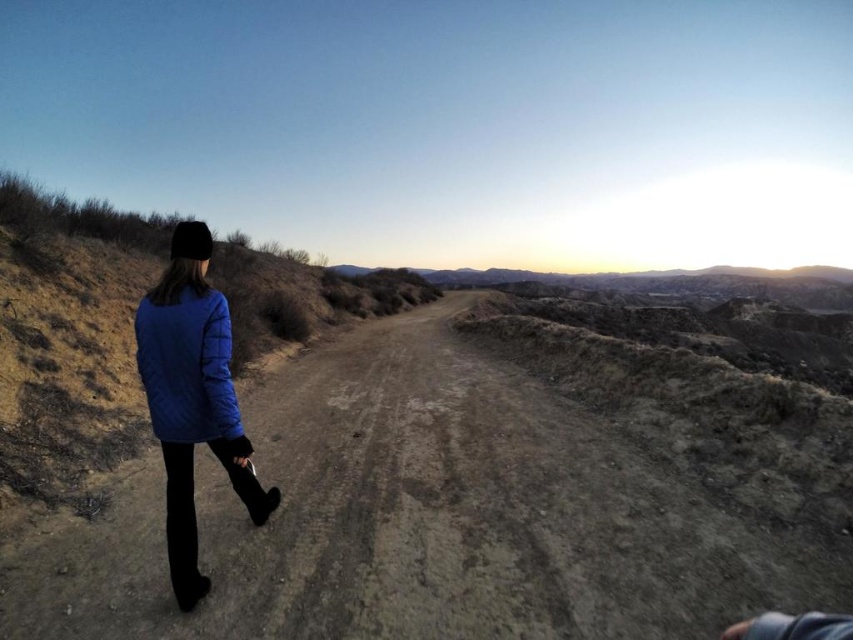
You are a hiker preparing to walk along the dirt path in the image. You see two jackets, the blue quilted jacket at lower left and the matte blue jacket at lower left. Which jacket is bigger in size?

The blue quilted jacket at lower left has a larger size compared to matte blue jacket at lower left.

You are standing at the starting point of the dirt path and see the blue quilted jacket at lower left and the matte blue jacket at lower left. Which jacket is closer to you?

Both jackets are at the lower left, but the blue quilted jacket at lower left is closer to you than the matte blue jacket at lower left since they are 4.35 meters apart.